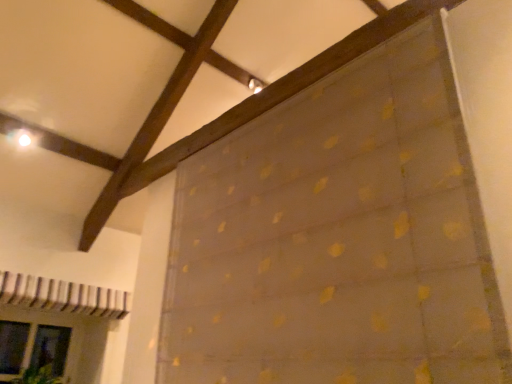
Question: From a real-world perspective, does translucent yellow dots at center sit lower than transparent glass door at lower left?

Choices:
 (A) yes
 (B) no

Answer: (B)

Question: Does translucent yellow dots at center lie behind transparent glass door at lower left?

Choices:
 (A) yes
 (B) no

Answer: (B)

Question: Can you confirm if translucent yellow dots at center is shorter than transparent glass door at lower left?

Choices:
 (A) no
 (B) yes

Answer: (A)

Question: Is translucent yellow dots at center oriented towards transparent glass door at lower left?

Choices:
 (A) no
 (B) yes

Answer: (A)

Question: From the image's perspective, is translucent yellow dots at center located beneath transparent glass door at lower left?

Choices:
 (A) no
 (B) yes

Answer: (A)

Question: Is translucent yellow dots at center smaller than transparent glass door at lower left?

Choices:
 (A) yes
 (B) no

Answer: (B)

Question: Can you confirm if transparent glass door at lower left is taller than translucent yellow dots at center?

Choices:
 (A) no
 (B) yes

Answer: (A)

Question: Is transparent glass door at lower left aimed at translucent yellow dots at center?

Choices:
 (A) no
 (B) yes

Answer: (B)

Question: Is transparent glass door at lower left behind translucent yellow dots at center?

Choices:
 (A) yes
 (B) no

Answer: (A)

Question: Is translucent yellow dots at center a part of transparent glass door at lower left?

Choices:
 (A) no
 (B) yes

Answer: (A)

Question: From a real-world perspective, is transparent glass door at lower left under translucent yellow dots at center?

Choices:
 (A) no
 (B) yes

Answer: (B)

Question: Is transparent glass door at lower left wider than translucent yellow dots at center?

Choices:
 (A) yes
 (B) no

Answer: (A)

Question: In terms of height, does translucent yellow dots at center look taller or shorter compared to transparent glass door at lower left?

Choices:
 (A) short
 (B) tall

Answer: (B)